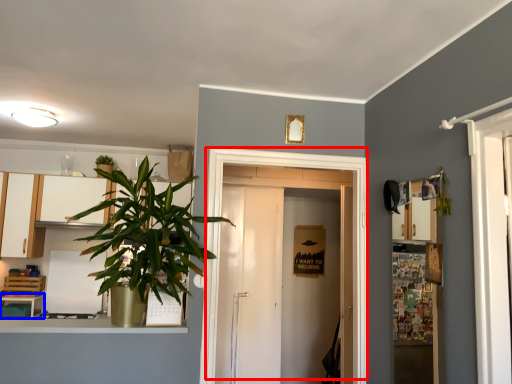
Question: Which object appears closest to the camera in this image, door (highlighted by a red box) or table (highlighted by a blue box)?

Choices:
 (A) door
 (B) table

Answer: (A)